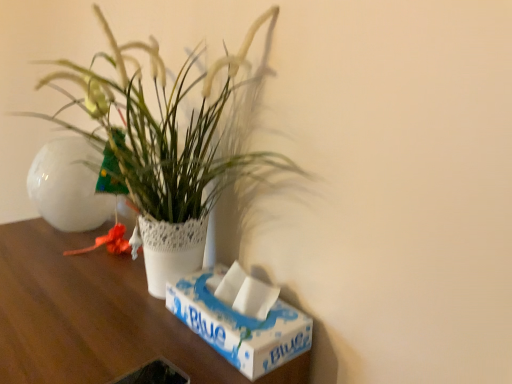
At what (x,y) coordinates should I click in order to perform the action: click on wooden table at center. Please return your answer as a coordinate pair (x, y). The width and height of the screenshot is (512, 384). Looking at the image, I should click on (86, 314).

From their relative heights in the image, would you say wooden table at center is taller or shorter than white lace pot at center?

Considering their sizes, wooden table at center has more height than white lace pot at center.

Where is `table on the left of white lace pot at center`? This screenshot has width=512, height=384. table on the left of white lace pot at center is located at coordinates (86, 314).

Is wooden table at center positioned beyond the bounds of white lace pot at center?

Yes.

Is wooden table at center oriented towards white lace pot at center?

No, wooden table at center does not turn towards white lace pot at center.

How far apart are white glossy flowerpot at left and white cardboard box at lower right?

They are 45.27 centimeters apart.

Is white glossy flowerpot at left bigger than white cardboard box at lower right?

Indeed, white glossy flowerpot at left has a larger size compared to white cardboard box at lower right.

Can you confirm if white glossy flowerpot at left is taller than white cardboard box at lower right?

Yes, white glossy flowerpot at left is taller than white cardboard box at lower right.

Does white glossy flowerpot at left touch white cardboard box at lower right?

No.

How far apart are white lace pot at center and white cardboard box at lower right?

9.97 inches.

Does white lace pot at center appear on the right side of white cardboard box at lower right?

Incorrect, white lace pot at center is not on the right side of white cardboard box at lower right.

Considering the sizes of objects white lace pot at center and white cardboard box at lower right in the image provided, who is bigger, white lace pot at center or white cardboard box at lower right?

white lace pot at center is bigger.

Consider the image. Considering the sizes of white cardboard box at lower right and white lace pot at center in the image, is white cardboard box at lower right bigger or smaller than white lace pot at center?

white cardboard box at lower right is smaller than white lace pot at center.

Is white cardboard box at lower right positioned beyond the bounds of white lace pot at center?

No, most part of white cardboard box at lower right lies within white lace pot at center.

Which is behind, point (248, 348) or point (101, 22)?

The point (101, 22) is farther.

Is wooden table at center inside or outside of white cardboard box at lower right?

wooden table at center is not enclosed by white cardboard box at lower right.

What's the angular difference between wooden table at center and white cardboard box at lower right's facing directions?

There is a 0.398-degree angle between the facing directions of wooden table at center and white cardboard box at lower right.

Relative to white cardboard box at lower right, is wooden table at center in front or behind?

Visually, wooden table at center is located in front of white cardboard box at lower right.

Considering the points (156, 328) and (298, 350), which point is in front, point (156, 328) or point (298, 350)?

Point (298, 350)

Image resolution: width=512 pixels, height=384 pixels. Find the location of `flowerpot that is on the left side of white lace pot at center`. flowerpot that is on the left side of white lace pot at center is located at coordinates (69, 185).

How many degrees apart are the facing directions of white lace pot at center and white glossy flowerpot at left?

3.09 degrees separate the facing orientations of white lace pot at center and white glossy flowerpot at left.

Consider the image. Is white lace pot at center positioned behind white glossy flowerpot at left?

No, it is in front of white glossy flowerpot at left.

Does white lace pot at center have a larger size compared to white glossy flowerpot at left?

Indeed, white lace pot at center has a larger size compared to white glossy flowerpot at left.

Is white glossy flowerpot at left looking in the opposite direction of white lace pot at center?

No.

Considering the sizes of objects white glossy flowerpot at left and white lace pot at center in the image provided, who is wider, white glossy flowerpot at left or white lace pot at center?

Wider between the two is white glossy flowerpot at left.

From the picture: From a real-world perspective, is white glossy flowerpot at left located higher than white lace pot at center?

No.

Looking at the image, does white glossy flowerpot at left seem bigger or smaller compared to white lace pot at center?

white glossy flowerpot at left is smaller than white lace pot at center.

Find the location of `table on the left of white lace pot at center`. table on the left of white lace pot at center is located at coordinates (86, 314).

This screenshot has height=384, width=512. I want to click on flowerpot above the white cardboard box at lower right (from the image's perspective), so click(x=69, y=185).

From the image, which object appears to be nearer to white cardboard box at lower right, white glossy flowerpot at left or white lace pot at center?

white lace pot at center is positioned closer to the anchor white cardboard box at lower right.

Based on their spatial positions, is white glossy flowerpot at left or white cardboard box at lower right further from wooden table at center?

Based on the image, white glossy flowerpot at left appears to be further to wooden table at center.

Based on the photo, based on their spatial positions, is wooden table at center or white cardboard box at lower right closer to white lace pot at center?

wooden table at center is positioned closer to the anchor white lace pot at center.

From the image, which object appears to be nearer to wooden table at center, white lace pot at center or white glossy flowerpot at left?

white glossy flowerpot at left lies closer to wooden table at center than the other object.

Estimate the real-world distances between objects in this image. Which object is closer to wooden table at center, white cardboard box at lower right or white glossy flowerpot at left?

Based on the image, white cardboard box at lower right appears to be nearer to wooden table at center.

From the image, which object appears to be nearer to white cardboard box at lower right, white glossy flowerpot at left or wooden table at center?

Based on the image, wooden table at center appears to be nearer to white cardboard box at lower right.

Consider the image. Looking at the image, which one is located further to white glossy flowerpot at left, white lace pot at center or white cardboard box at lower right?

white cardboard box at lower right is further to white glossy flowerpot at left.

Considering their positions, is white cardboard box at lower right positioned closer to white glossy flowerpot at left than white lace pot at center?

The object closer to white glossy flowerpot at left is white lace pot at center.

Find the location of a particular element. The height and width of the screenshot is (384, 512). box between wooden table at center and white glossy flowerpot at left along the z-axis is located at coordinates (240, 326).

Find the location of `box that lies between white lace pot at center and wooden table at center from top to bottom`. box that lies between white lace pot at center and wooden table at center from top to bottom is located at coordinates (240, 326).

At what (x,y) coordinates should I click in order to perform the action: click on box positioned between white lace pot at center and white glossy flowerpot at left from near to far. Please return your answer as a coordinate pair (x, y). The height and width of the screenshot is (384, 512). Looking at the image, I should click on (240, 326).

The width and height of the screenshot is (512, 384). Find the location of `flowerpot between white lace pot at center and wooden table at center vertically`. flowerpot between white lace pot at center and wooden table at center vertically is located at coordinates (69, 185).